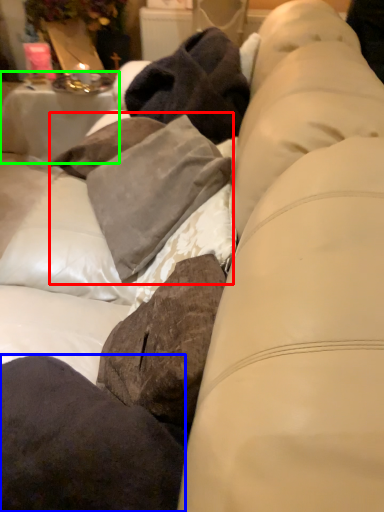
Question: Which object is the closest to the clothing (highlighted by a red box)? Choose among these: pillow (highlighted by a blue box) or table (highlighted by a green box).

Choices:
 (A) pillow
 (B) table

Answer: (A)